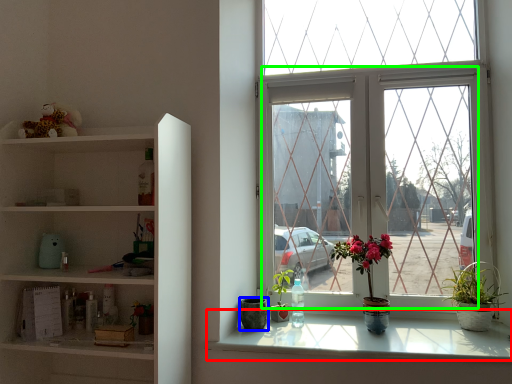
Question: Which is farther away from window sill (highlighted by a red box)? flowerpot (highlighted by a blue box) or glass window (highlighted by a green box)?

Choices:
 (A) flowerpot
 (B) glass window

Answer: (B)